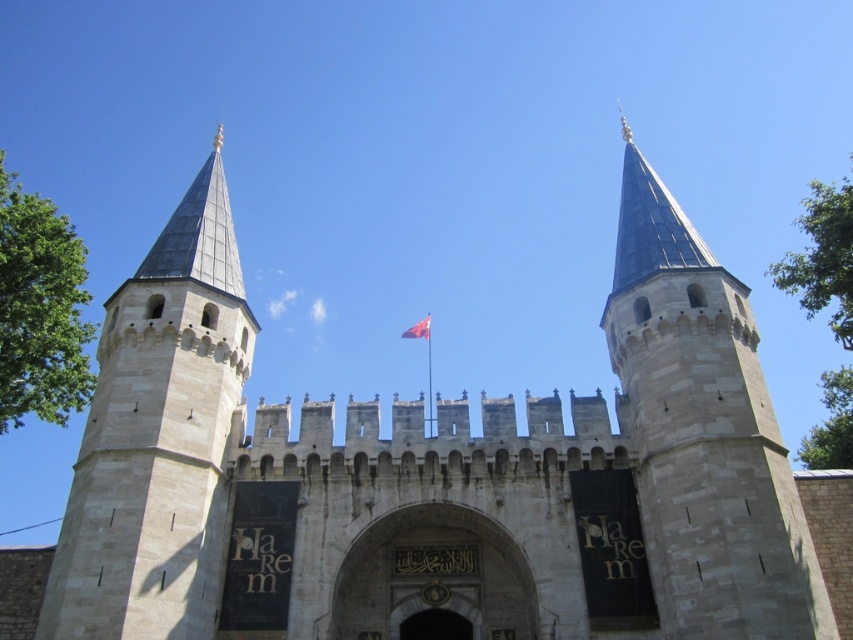
You are a visitor standing in front of the grand fortress gate. You notice a stone tower at center and a red fabric flag at center. Which object is wider from your perspective?

The stone tower at center is wider than the red fabric flag at center.